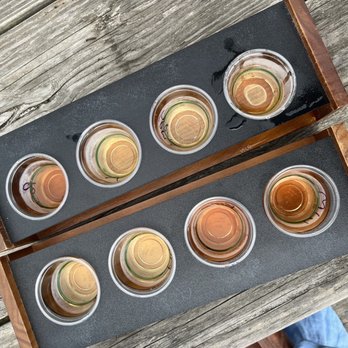
Locate an element on the screen. cup is located at coordinates pos(167,278).